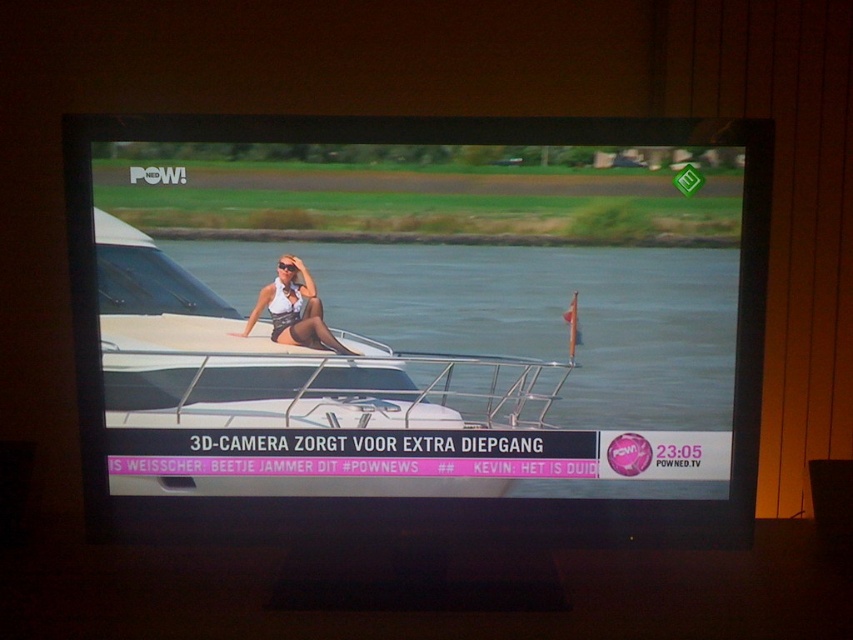
Question: Which of the following is the closest to the observer?

Choices:
 (A) clear water at center
 (B) matte white bikini at center

Answer: (A)

Question: Does white glossy boat at center appear on the left side of matte white bikini at center?

Choices:
 (A) no
 (B) yes

Answer: (A)

Question: Which point is farther to the camera?

Choices:
 (A) clear water at center
 (B) white glossy boat at center

Answer: (A)

Question: Can you confirm if white glossy boat at center is positioned below clear water at center?

Choices:
 (A) no
 (B) yes

Answer: (B)

Question: Among these objects, which one is nearest to the camera?

Choices:
 (A) clear water at center
 (B) matte white bikini at center

Answer: (A)

Question: Does clear water at center have a greater width compared to matte white bikini at center?

Choices:
 (A) yes
 (B) no

Answer: (A)